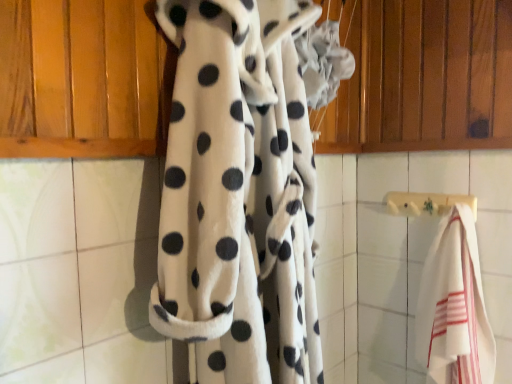
Question: From the image's perspective, does wooden towel bar at center appear higher than white striped towel at right?

Choices:
 (A) yes
 (B) no

Answer: (A)

Question: Is there a large distance between wooden towel bar at center and white striped towel at right?

Choices:
 (A) yes
 (B) no

Answer: (B)

Question: Is wooden towel bar at center positioned with its back to white striped towel at right?

Choices:
 (A) yes
 (B) no

Answer: (A)

Question: From the image's perspective, is wooden towel bar at center beneath white striped towel at right?

Choices:
 (A) yes
 (B) no

Answer: (B)

Question: Is wooden towel bar at center positioned in front of white striped towel at right?

Choices:
 (A) yes
 (B) no

Answer: (B)

Question: From a real-world perspective, does wooden towel bar at center stand above white striped towel at right?

Choices:
 (A) no
 (B) yes

Answer: (B)

Question: From a real-world perspective, is white striped towel at right physically above wooden towel bar at center?

Choices:
 (A) yes
 (B) no

Answer: (B)

Question: Considering the relative sizes of white striped towel at right and wooden towel bar at center in the image provided, is white striped towel at right wider than wooden towel bar at center?

Choices:
 (A) no
 (B) yes

Answer: (B)

Question: Considering the relative positions of white striped towel at right and wooden towel bar at center in the image provided, is white striped towel at right behind wooden towel bar at center?

Choices:
 (A) yes
 (B) no

Answer: (B)

Question: From a real-world perspective, does white striped towel at right sit lower than wooden towel bar at center?

Choices:
 (A) no
 (B) yes

Answer: (B)

Question: Is white striped towel at right positioned beyond the bounds of wooden towel bar at center?

Choices:
 (A) no
 (B) yes

Answer: (B)

Question: Considering the relative sizes of white striped towel at right and wooden towel bar at center in the image provided, is white striped towel at right thinner than wooden towel bar at center?

Choices:
 (A) no
 (B) yes

Answer: (A)

Question: Considering the relative sizes of white fleece blanket at center and white striped towel at right in the image provided, is white fleece blanket at center shorter than white striped towel at right?

Choices:
 (A) no
 (B) yes

Answer: (A)